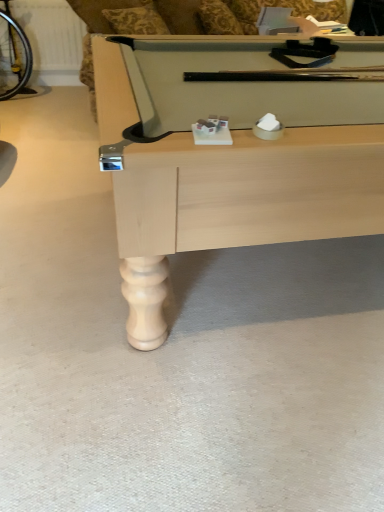
Identify the location of free point in front of metallic yellow wheel at left. This screenshot has width=384, height=512. (23, 98).